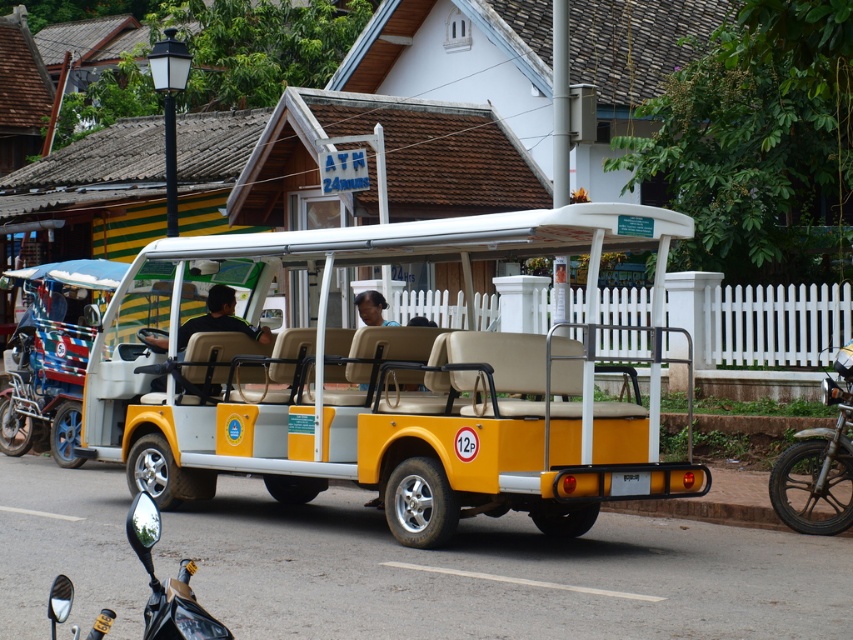
Question: Is yellow matte golf cart at center to the left of black matte shirt at center from the viewer's perspective?

Choices:
 (A) yes
 (B) no

Answer: (B)

Question: Which point is farther to the camera?

Choices:
 (A) (264, 340)
 (B) (851, 448)

Answer: (A)

Question: Which point is farther to the camera?

Choices:
 (A) (149, 602)
 (B) (355, 298)
 (C) (241, 442)
 (D) (787, 524)

Answer: (B)

Question: In this image, where is metallic silver mirror at lower left located relative to black matte shirt at center?

Choices:
 (A) left
 (B) right

Answer: (B)

Question: Among these objects, which one is farthest from the camera?

Choices:
 (A) black matte shirt at center
 (B) metallic silver mirror at lower left
 (C) dark brown skin at center
 (D) yellow matte golf cart at center

Answer: (C)

Question: Is yellow matte golf cart at center further to the viewer compared to metallic silver mirror at lower left?

Choices:
 (A) no
 (B) yes

Answer: (B)